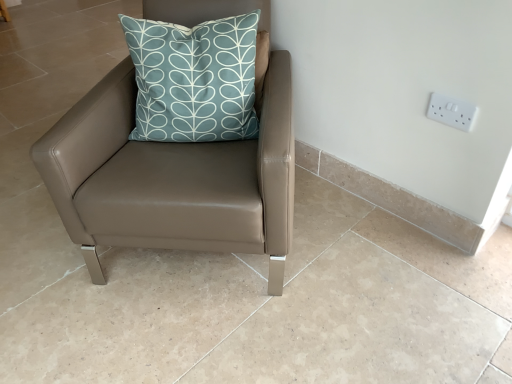
Question: Is teal fabric cushion at upper center facing towards matte brown leather chair at center?

Choices:
 (A) yes
 (B) no

Answer: (A)

Question: Is teal fabric cushion at upper center located outside matte brown leather chair at center?

Choices:
 (A) no
 (B) yes

Answer: (A)

Question: From a real-world perspective, is teal fabric cushion at upper center on top of matte brown leather chair at center?

Choices:
 (A) yes
 (B) no

Answer: (A)

Question: Is teal fabric cushion at upper center far from matte brown leather chair at center?

Choices:
 (A) yes
 (B) no

Answer: (B)

Question: Does teal fabric cushion at upper center have a larger size compared to matte brown leather chair at center?

Choices:
 (A) yes
 (B) no

Answer: (B)

Question: Is teal fabric cushion at upper center next to matte brown leather chair at center?

Choices:
 (A) yes
 (B) no

Answer: (B)

Question: Is matte brown leather chair at center smaller than white plastic electric outlet at upper right?

Choices:
 (A) no
 (B) yes

Answer: (A)

Question: Is matte brown leather chair at center beside white plastic electric outlet at upper right?

Choices:
 (A) yes
 (B) no

Answer: (B)

Question: Would you say matte brown leather chair at center is a long distance from white plastic electric outlet at upper right?

Choices:
 (A) yes
 (B) no

Answer: (B)

Question: Is matte brown leather chair at center shorter than white plastic electric outlet at upper right?

Choices:
 (A) no
 (B) yes

Answer: (A)

Question: Is matte brown leather chair at center thinner than white plastic electric outlet at upper right?

Choices:
 (A) no
 (B) yes

Answer: (A)

Question: Does matte brown leather chair at center turn towards white plastic electric outlet at upper right?

Choices:
 (A) no
 (B) yes

Answer: (A)

Question: From a real-world perspective, is teal fabric cushion at upper center beneath white plastic electric outlet at upper right?

Choices:
 (A) yes
 (B) no

Answer: (B)